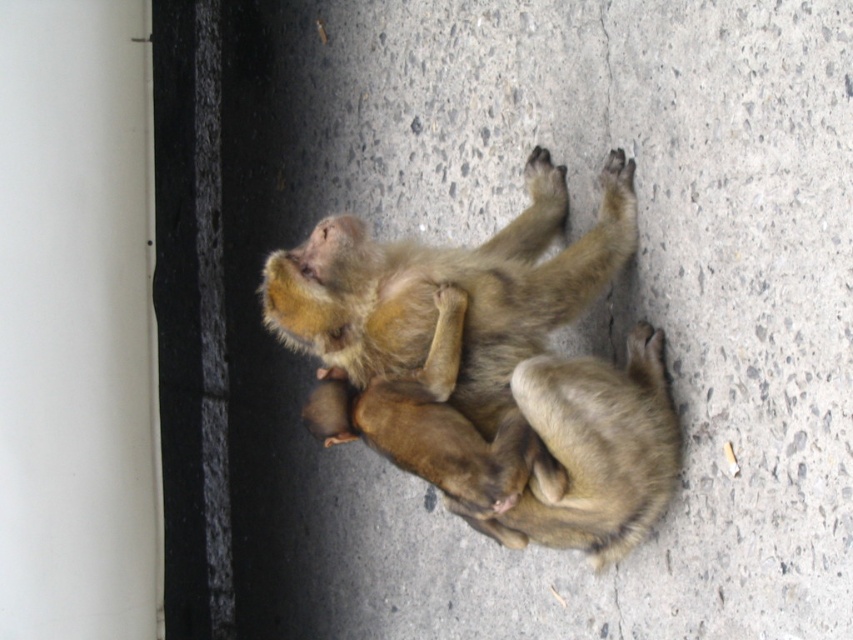
Is gray concrete at center wider than golden fur monkey at center?

Yes, gray concrete at center is wider than golden fur monkey at center.

Does gray concrete at center appear on the left side of golden fur monkey at center?

Indeed, gray concrete at center is positioned on the left side of golden fur monkey at center.

Who is more forward, (282, 492) or (613, 156)?

Point (613, 156) is more forward.

Identify the location of gray concrete at center. (566, 326).

From the picture: Is golden fur monkey at center taller than fuzzy brown monkey at center?

Yes, golden fur monkey at center is taller than fuzzy brown monkey at center.

Is golden fur monkey at center positioned before fuzzy brown monkey at center?

That is False.

Locate an element on the screen. golden fur monkey at center is located at coordinates (506, 353).

The width and height of the screenshot is (853, 640). What are the coordinates of `golden fur monkey at center` in the screenshot? It's located at (506, 353).

Which is behind, point (345, 628) or point (547, 356)?

Positioned behind is point (345, 628).

Between point (448, 600) and point (606, 552), which one is positioned in front?

Positioned in front is point (606, 552).

Is point (556, 147) positioned in front of point (660, 476)?

No, (556, 147) is behind (660, 476).

The image size is (853, 640). I want to click on gray concrete at center, so pyautogui.click(x=566, y=326).